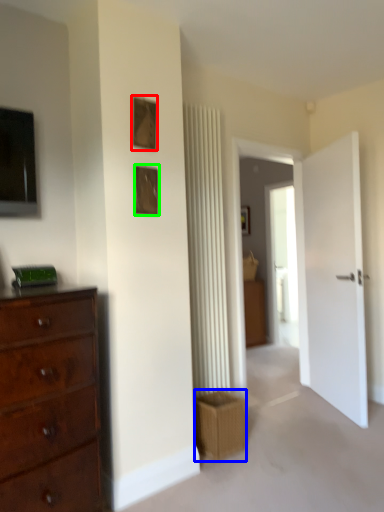
Question: Based on their relative distances, which object is nearer to picture frame (highlighted by a red box)? Choose from crate (highlighted by a blue box) and picture frame (highlighted by a green box).

Choices:
 (A) crate
 (B) picture frame

Answer: (B)